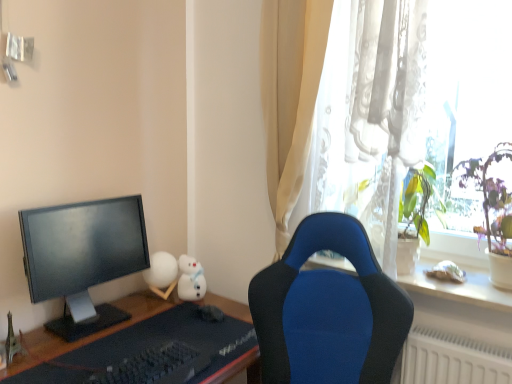
Identify the location of blank space situated above black matte keyboard at lower center (from a real-world perspective). This screenshot has width=512, height=384. (141, 364).